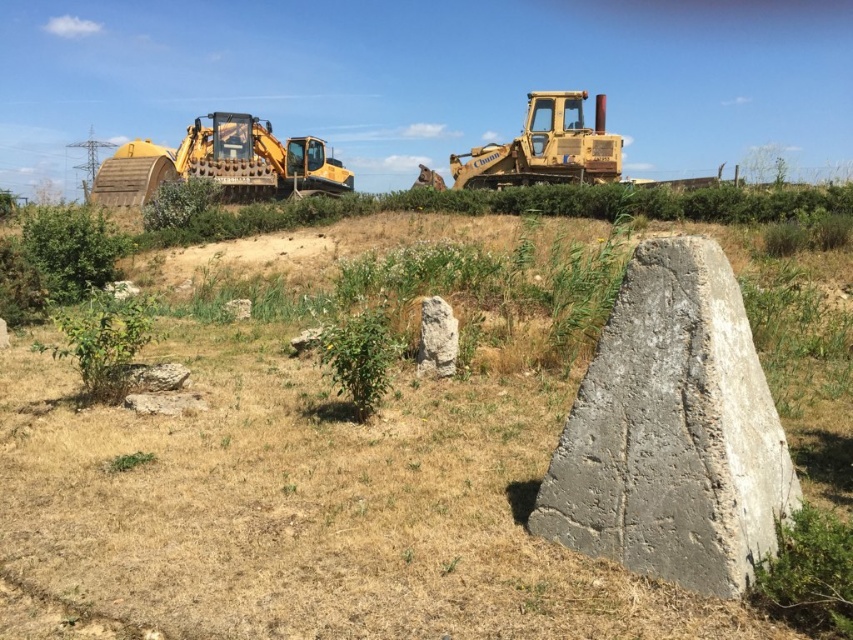
From the picture: You are standing in the outdoor scene looking at the large concrete structure. There are two points marked on the structure. Which point is closer to you, point [648,486] or point [613,180]?

Point [648,486] is closer to the viewer than point [613,180].

You are standing in the outdoor scene and want to place a small flag at each of the two points marked in the image. Which point, point (x=648, y=596) or point (x=764, y=534), is closer to you so that I can ensure the flag is visible from here?

Point (x=648, y=596) is closer to the viewer than point (x=764, y=534), so placing the flag there will make it more visible from your current position.

You are a gardener trying to move the gray concrete boulder at center and the yellow metallic tractor at upper left to the opposite side of the garden. Which object will require more effort to move based on their sizes?

The yellow metallic tractor at upper left will require more effort to move because it occupies more space than the gray concrete boulder at center.